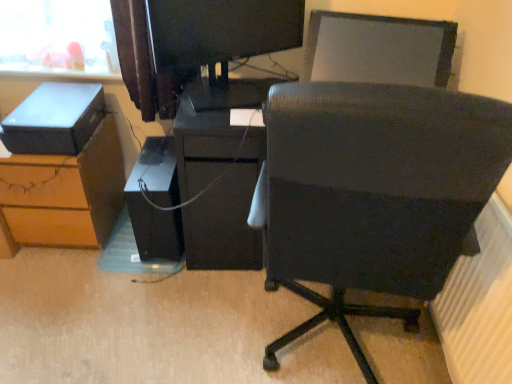
Question: From a real-world perspective, is black fabric chair at center positioned above or below brown wood desk at lower left?

Choices:
 (A) below
 (B) above

Answer: (B)

Question: Considering the positions of black fabric chair at center and brown wood desk at lower left in the image, is black fabric chair at center taller or shorter than brown wood desk at lower left?

Choices:
 (A) short
 (B) tall

Answer: (B)

Question: Which object is positioned closest to the brown wood desk at lower left?

Choices:
 (A) matte black desk at center
 (B) white textured radiator at lower right
 (C) black matte computer tower at center
 (D) matte black storage box at left
 (E) matte black monitor at upper center

Answer: (D)

Question: Which object is positioned closest to the black fabric chair at center?

Choices:
 (A) matte black desk at center
 (B) brown wood desk at lower left
 (C) matte black storage box at left
 (D) matte black monitor at upper center
 (E) white textured radiator at lower right

Answer: (E)